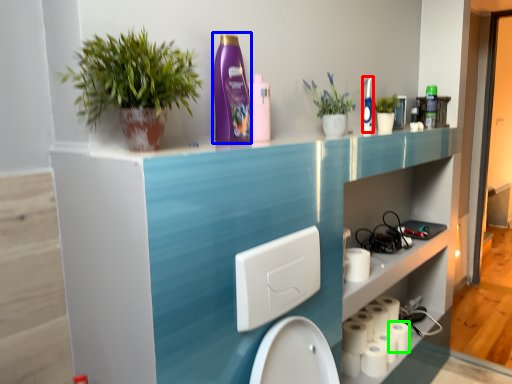
Question: Which object is the farthest from cleaning product (highlighted by a red box)? Choose among these: cleaning product (highlighted by a blue box) or toilet paper (highlighted by a green box).

Choices:
 (A) cleaning product
 (B) toilet paper

Answer: (B)